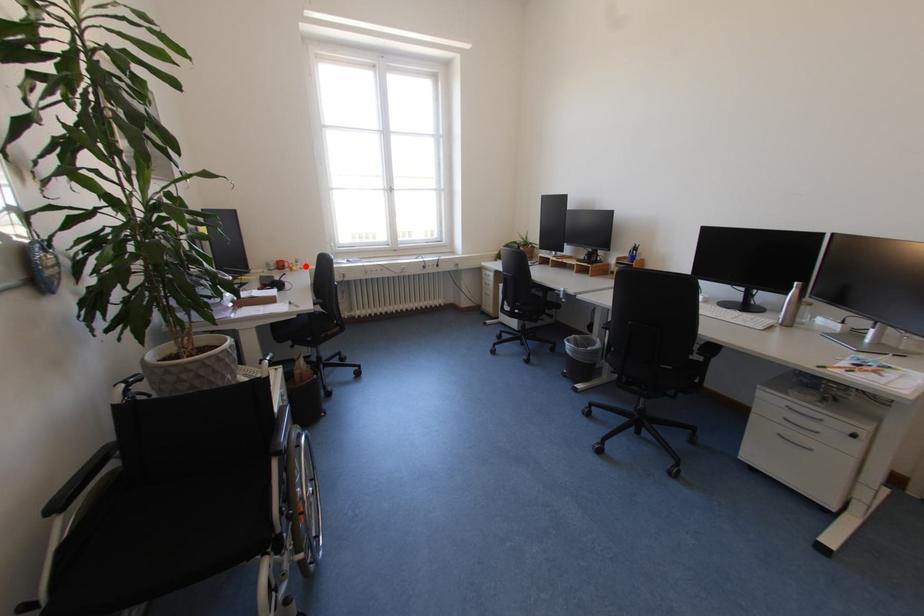
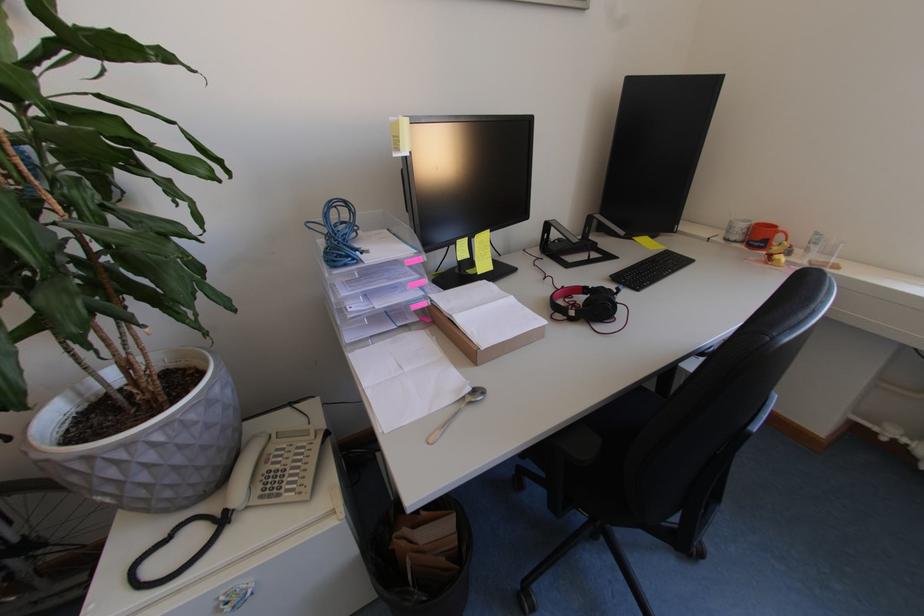
The point at the highlighted location is marked in the first image. Where is the corresponding point in the second image?

(816, 253)